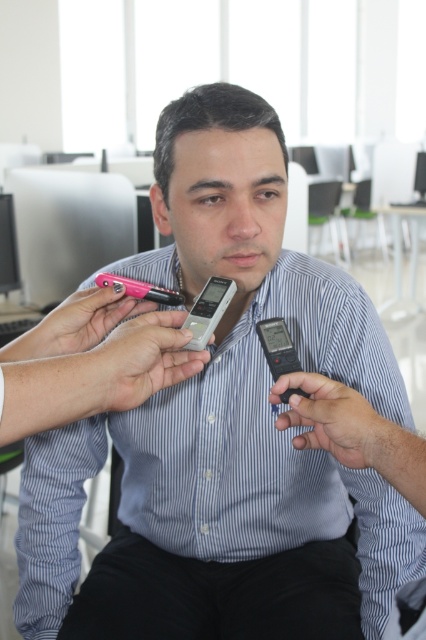
Question: Can you confirm if silver metallic smartphone at center is thinner than pink plastic smartphone at center?

Choices:
 (A) yes
 (B) no

Answer: (A)

Question: Is silver metallic smartphone at center bigger than pink plastic smartphone at center?

Choices:
 (A) yes
 (B) no

Answer: (A)

Question: Estimate the real-world distances between objects in this image. Which object is farther from the pink plastic smartphone at center?

Choices:
 (A) black cotton pants at lower center
 (B) silver metallic smartphone at center
 (C) black plastic smartphone at center

Answer: (A)

Question: Based on their relative distances, which object is farther from the black cotton pants at lower center?

Choices:
 (A) black plastic smartphone at center
 (B) silver metallic smartphone at center

Answer: (B)

Question: Can you confirm if black plastic smartphone at center is positioned below pink plastic smartphone at center?

Choices:
 (A) yes
 (B) no

Answer: (A)

Question: Which point is closer to the camera?

Choices:
 (A) pink plastic smartphone at center
 (B) silver metallic smartphone at center

Answer: (B)